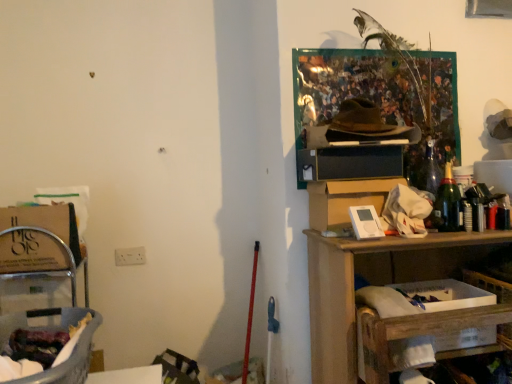
Question: Choose the correct answer: Is matte brown cardboard box at left, the 1th cardboard box viewed from the left, inside white cardboard box at lower right or outside it?

Choices:
 (A) outside
 (B) inside

Answer: (A)

Question: From the image's perspective, relative to white cardboard box at lower right, is matte brown cardboard box at left, placed as the second cardboard box when sorted from right to left, above or below?

Choices:
 (A) above
 (B) below

Answer: (A)

Question: Which object is the closest to the green glass bottle at right?

Choices:
 (A) white cardboard box at upper right, positioned as the first cardboard box in right-to-left order
 (B) translucent plastic laundry basket at lower left
 (C) wooden shelf at right
 (D) white cardboard box at lower right
 (E) matte brown cardboard box at left, placed as the second cardboard box when sorted from right to left

Answer: (A)

Question: Based on their relative distances, which object is nearer to the green glass bottle at right?

Choices:
 (A) white cardboard box at lower right
 (B) wooden shelf at right
 (C) white cardboard box at upper right, positioned as the first cardboard box in right-to-left order
 (D) matte brown cardboard box at left, the 1th cardboard box viewed from the left
 (E) translucent plastic laundry basket at lower left

Answer: (C)